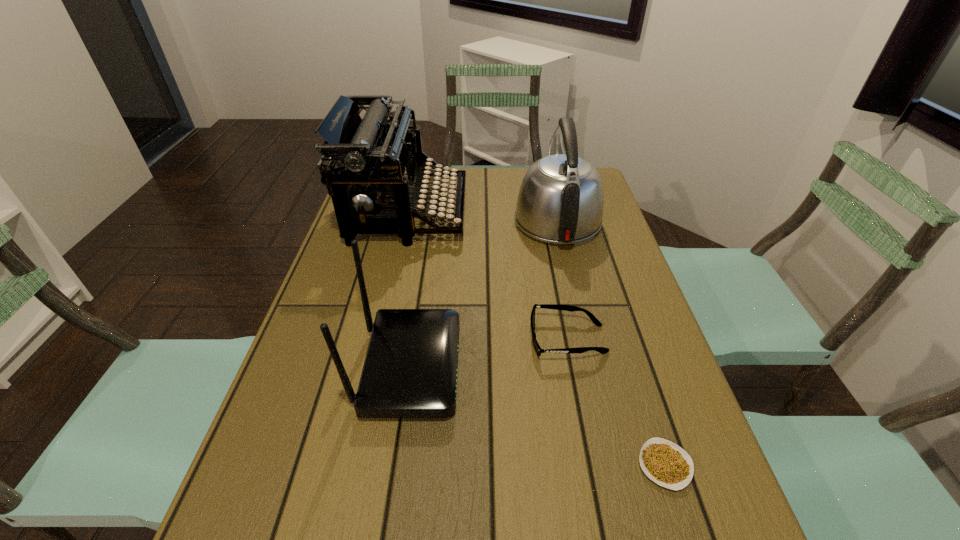
Find the location of `blank area in the image that satisfies the following two spatial constraints: 1. on the front-facing side of the router; 2. on the right side of the shortest object`. blank area in the image that satisfies the following two spatial constraints: 1. on the front-facing side of the router; 2. on the right side of the shortest object is located at coordinates (395, 465).

Where is `free location that satisfies the following two spatial constraints: 1. on the back side of the shortest object; 2. on the front-facing side of the fourth tallest object`? This screenshot has height=540, width=960. free location that satisfies the following two spatial constraints: 1. on the back side of the shortest object; 2. on the front-facing side of the fourth tallest object is located at coordinates (624, 339).

I want to click on vacant space that satisfies the following two spatial constraints: 1. on the front-facing side of the third tallest object; 2. on the left side of the legume, so click(x=395, y=465).

Locate an element on the screen. Image resolution: width=960 pixels, height=540 pixels. blank space that satisfies the following two spatial constraints: 1. on the front-facing side of the fourth tallest object; 2. on the left side of the shortest object is located at coordinates (592, 465).